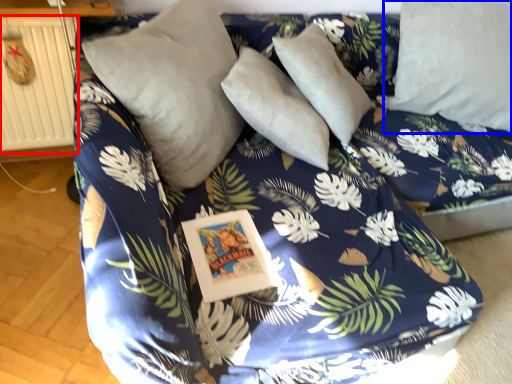
Question: Which of the following is the farthest to the observer, radiator (highlighted by a red box) or pillow (highlighted by a blue box)?

Choices:
 (A) radiator
 (B) pillow

Answer: (B)